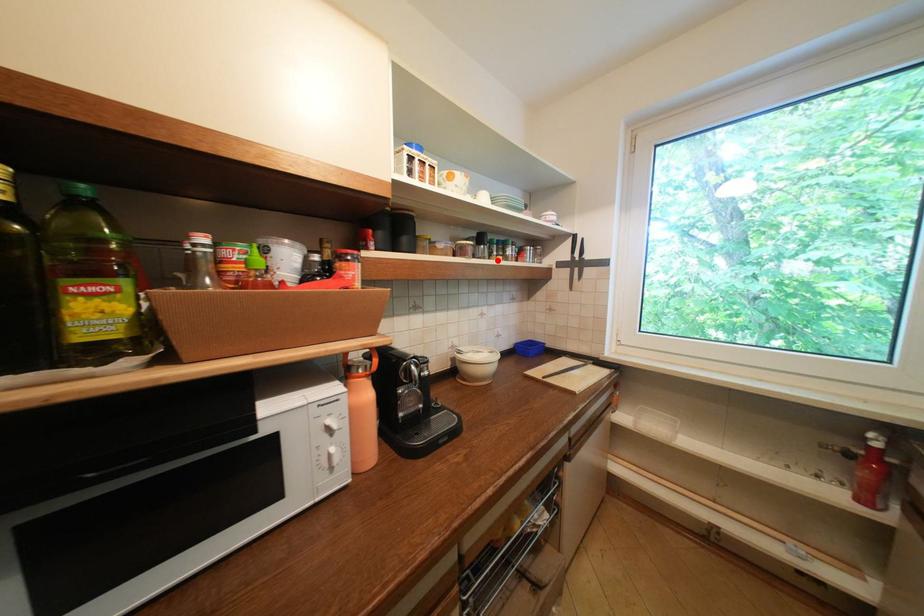
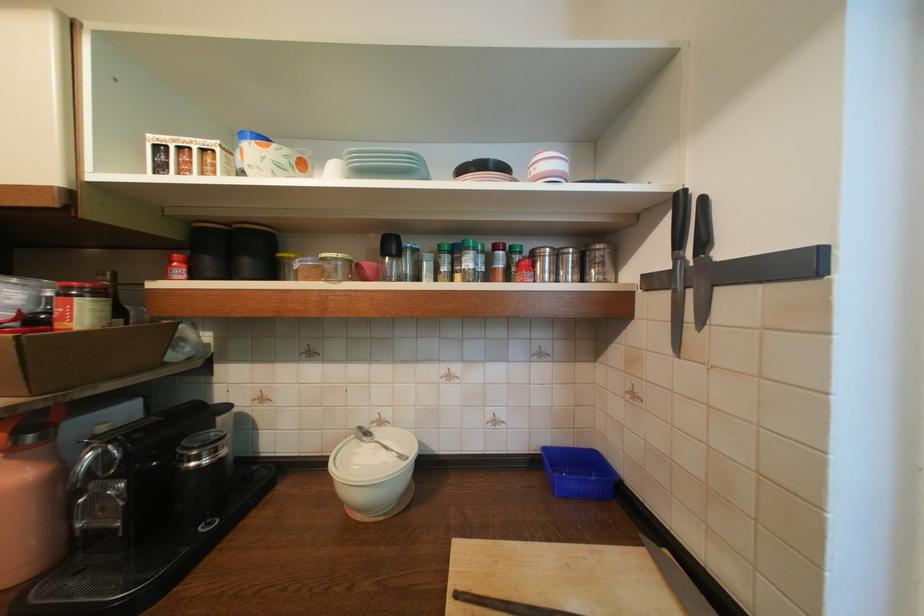
Where in the second image is the point corresponding to the highlighted location from the first image?

(444, 282)